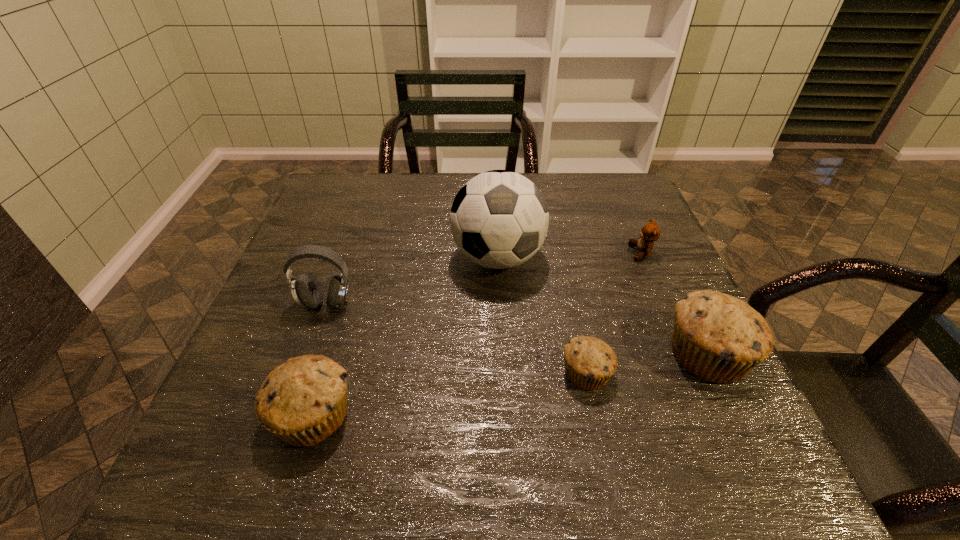
Identify the location of empty space between the soccer ball and the fourth tallest object. (x=405, y=336).

Find the location of a particular element. vacant region between the shortest muffin and the teddy bear is located at coordinates (613, 313).

The height and width of the screenshot is (540, 960). Identify the location of vacant space in between the tallest object and the third farthest object. [412, 280].

The height and width of the screenshot is (540, 960). I want to click on vacant area that lies between the teddy bear and the shortest muffin, so [613, 313].

Where is `empty location between the fourth nearest object and the tallest object`? empty location between the fourth nearest object and the tallest object is located at coordinates (412, 280).

Identify the location of vacant region between the shortest muffin and the rightmost muffin. The width and height of the screenshot is (960, 540). (647, 363).

Point out which object is positioned as the second nearest to the third farthest object. Please provide its 2D coordinates. Your answer should be formatted as a tuple, i.e. [(x, y)], where the tuple contains the x and y coordinates of a point satisfying the conditions above.

[(499, 219)]

Identify the location of the closest object relative to the rightmost muffin. (590, 362).

Identify the location of muffin that is the second closest one to the rightmost muffin. (303, 401).

I want to click on muffin that is the second closest to the fourth tallest object, so click(x=719, y=338).